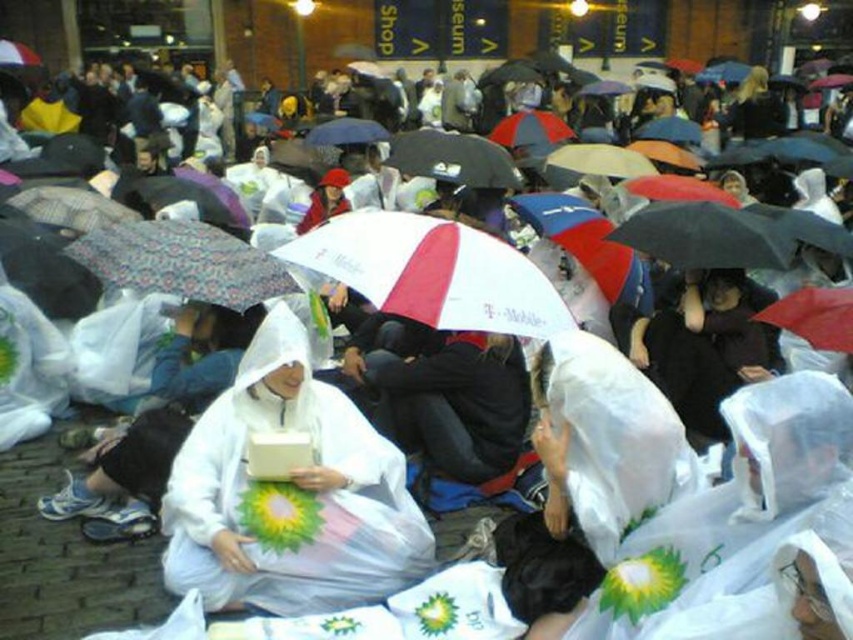
Question: Which point is farther to the camera?

Choices:
 (A) whitematerialumbrella at center
 (B) patterned fabric umbrella at center
 (C) white matte raincoat at center

Answer: (B)

Question: Which object is closer to the camera taking this photo?

Choices:
 (A) patterned fabric umbrella at center
 (B) white matte raincoat at center
 (C) whitematerialumbrella at center

Answer: (B)

Question: Is whitematerialumbrella at center further to the viewer compared to patterned fabric umbrella at center?

Choices:
 (A) no
 (B) yes

Answer: (A)

Question: Can you confirm if white matte raincoat at center is positioned to the left of whitematerialumbrella at center?

Choices:
 (A) no
 (B) yes

Answer: (B)

Question: Among these points, which one is nearest to the camera?

Choices:
 (A) (219, 579)
 (B) (512, 324)

Answer: (A)

Question: Is white matte raincoat at center in front of whitematerialumbrella at center?

Choices:
 (A) no
 (B) yes

Answer: (B)